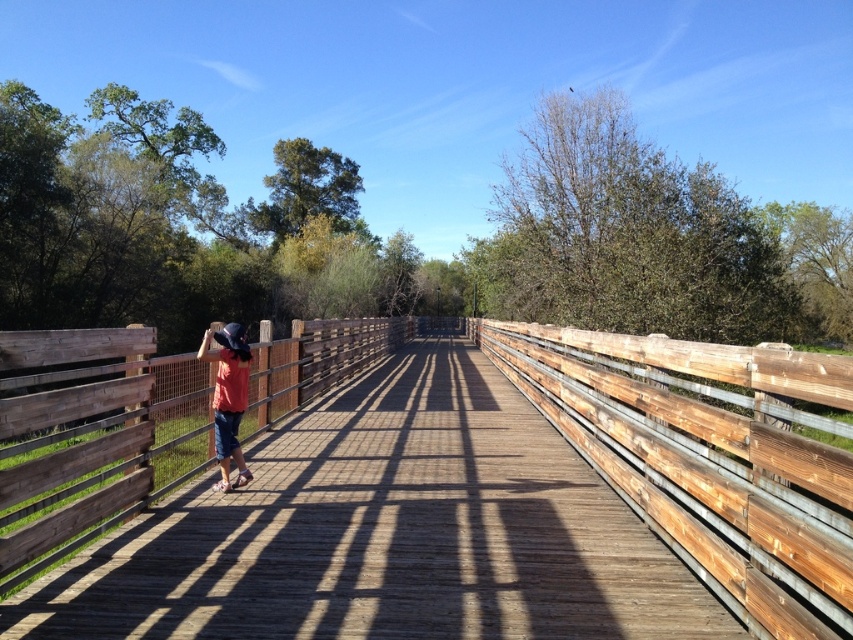
You are standing at the point marked as point (x=337, y=627) on the wooden bridge. The person walking away from the camera is 3.64 meters away from you. If you want to take a photo of them without them noticing, should you move closer or stay where you are?

You should stay where you are because the person is 3.64 meters away from point (x=337, y=627). Moving closer might make them notice you.

You are standing on the wooden bridge at center and need to hand a small item to the person wearing denim shorts at left. Can you reach them without moving from your current position?

The wooden bridge at center and denim shorts at left are 3.28 meters apart from each other. Since the average human arm length is about 0.7 meters, you cannot reach them without moving.